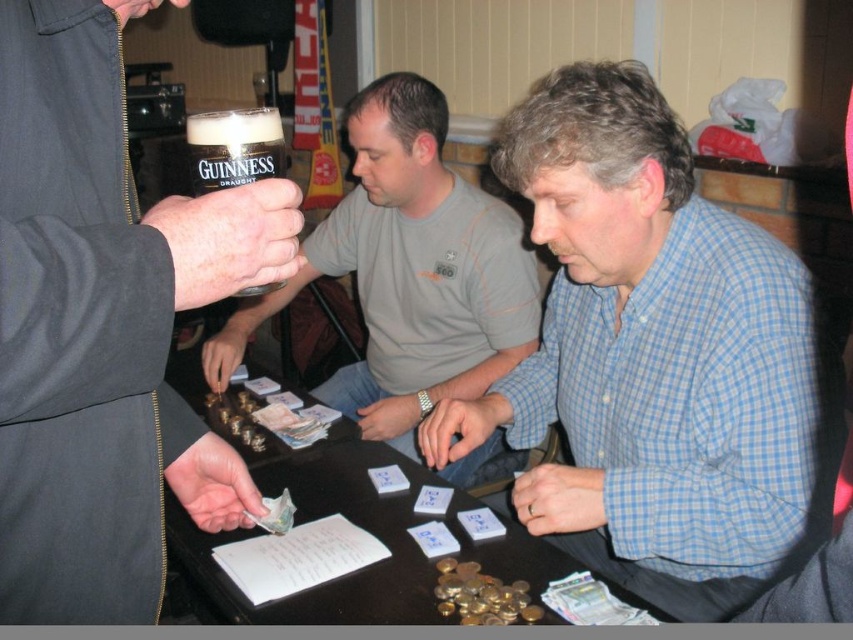
You are at a bar and want to pour a drink into the taller of the two matte black glasses. Which one should you choose between the matte black glass at left and the matte black glass at center?

The matte black glass at center is taller than the matte black glass at left, so you should choose the matte black glass at center.